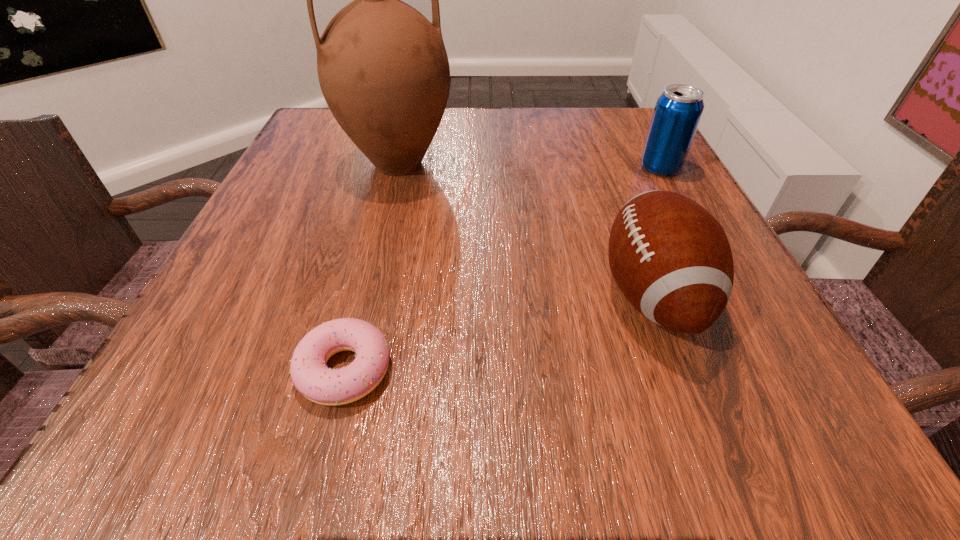
The image size is (960, 540). I want to click on the tallest object, so click(x=383, y=69).

The height and width of the screenshot is (540, 960). Identify the location of pop soda. (678, 110).

What are the coordinates of `football` in the screenshot? It's located at (671, 259).

Locate an element on the screen. This screenshot has height=540, width=960. doughnut is located at coordinates point(310,375).

Where is `free location located on the right of the pitcher`? The width and height of the screenshot is (960, 540). free location located on the right of the pitcher is located at coordinates (489, 164).

What are the coordinates of `free space located 0.270m on the left of the pop soda` in the screenshot? It's located at (504, 167).

Identify the location of free space located 0.380m on the laces of the football. The width and height of the screenshot is (960, 540). (338, 294).

Image resolution: width=960 pixels, height=540 pixels. I want to click on free space located 0.100m on the laces of the football, so click(532, 294).

Find the location of a particular element. Image resolution: width=960 pixels, height=540 pixels. free point located 0.150m on the laces of the football is located at coordinates (497, 294).

The width and height of the screenshot is (960, 540). Find the location of `vacant space located on the back of the doughnut`. vacant space located on the back of the doughnut is located at coordinates (365, 293).